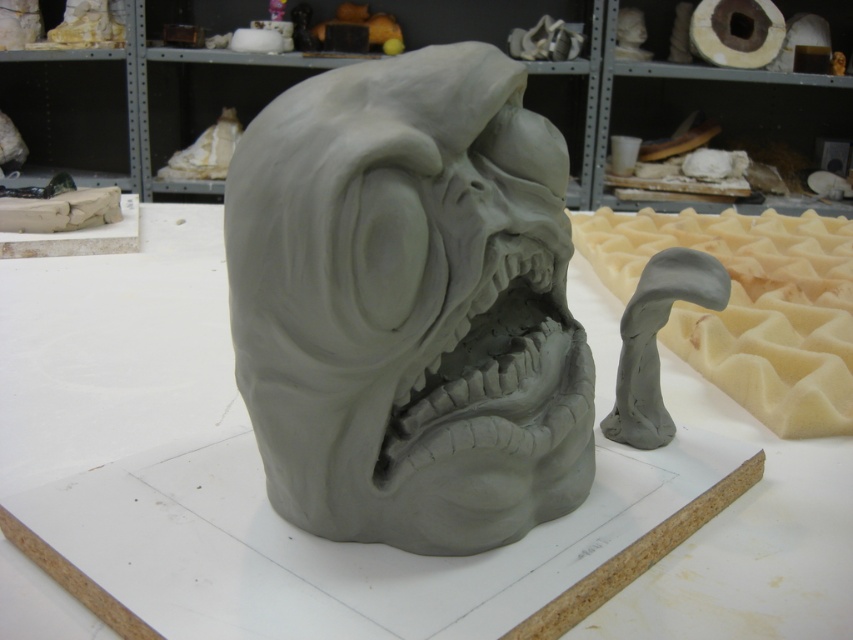
You are an art student who wants to place a 5 cm ruler between the gray clay sculpture at center and the gray clay mouth at center. Will the ruler fit in the space between them?

The distance between the gray clay sculpture at center and the gray clay mouth at center is 4.75 centimeters, so the 5 cm ruler will not fit as it is slightly longer than the available space.

You are an art student who wants to place both the gray clay sculpture at center and the gray clay mouth at center on a shelf. The shelf can only hold items where the larger item is placed first. Which one should you place first?

The gray clay sculpture at center is larger than the gray clay mouth at center, so you should place the gray clay sculpture at center first on the shelf.

You are an art student who wants to place a small clay tool to the right of the gray clay mouth at center. However, you must ensure that the tool is positioned to the right of the gray clay sculpture at center. Is this possible given their current arrangement?

The gray clay sculpture at center is to the left of the gray clay mouth at center. Therefore, placing the tool to the right of the gray clay mouth at center would automatically place it to the right of the gray clay sculpture at center as well. This arrangement is possible.